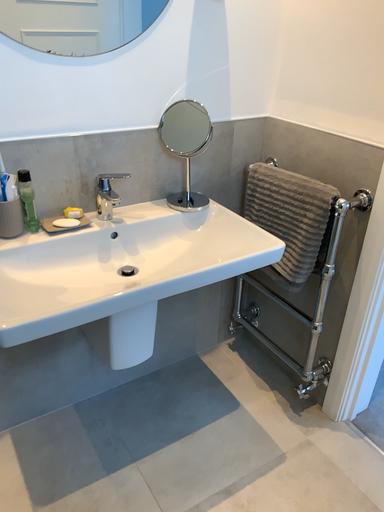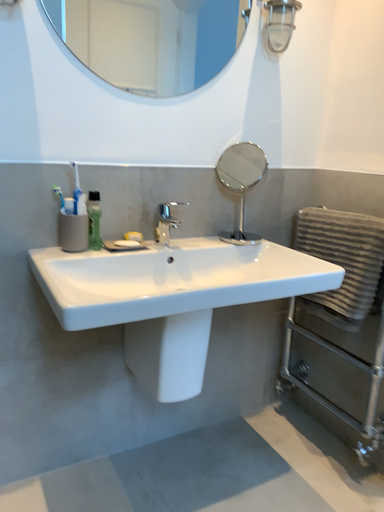
Question: How did the camera likely rotate when shooting the video?

Choices:
 (A) rotated downward
 (B) rotated upward

Answer: (B)